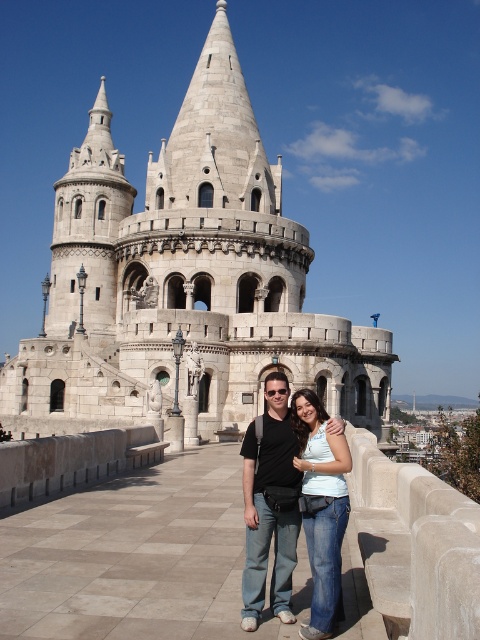
Question: Which point is farther from the camera taking this photo?

Choices:
 (A) (290, 369)
 (B) (273, 518)

Answer: (A)

Question: Does white stone fort at center appear over matte black shirt at center?

Choices:
 (A) no
 (B) yes

Answer: (B)

Question: Does white stone fort at center have a lesser width compared to denim jeans at center?

Choices:
 (A) no
 (B) yes

Answer: (A)

Question: Which point is farther from the camera taking this photo?

Choices:
 (A) (319, 545)
 (B) (268, 396)

Answer: (B)

Question: Which object is farther from the camera taking this photo?

Choices:
 (A) denim jeans at center
 (B) white stone fort at center

Answer: (B)

Question: Is matte black shirt at center thinner than denim jeans at center?

Choices:
 (A) yes
 (B) no

Answer: (B)